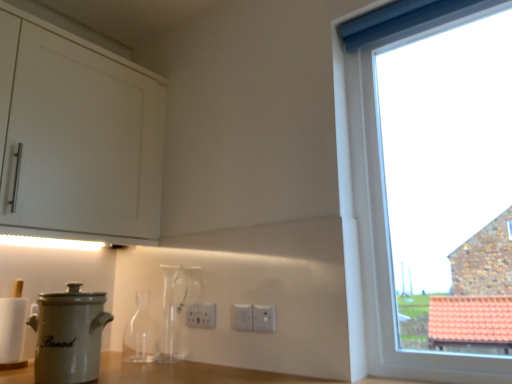
Question: Which direction should I rotate to look at white plastic electric outlet at center, marked as the 1th electric outlet in a right-to-left arrangement?

Choices:
 (A) left
 (B) right

Answer: (B)

Question: Is white matte cabinet at upper left completely or partially inside white plastic electric outlet at center, marked as the 1th electric outlet in a right-to-left arrangement?

Choices:
 (A) yes
 (B) no

Answer: (B)

Question: Is white plastic electric outlet at center, the third electric outlet positioned from the back, positioned with its back to white matte cabinet at upper left?

Choices:
 (A) yes
 (B) no

Answer: (B)

Question: Can you confirm if white plastic electric outlet at center, the third electric outlet positioned from the back, is wider than white matte cabinet at upper left?

Choices:
 (A) no
 (B) yes

Answer: (A)

Question: From a real-world perspective, is white plastic electric outlet at center, the third electric outlet positioned from the back, positioned under white matte cabinet at upper left based on gravity?

Choices:
 (A) no
 (B) yes

Answer: (B)

Question: From the image's perspective, is white plastic electric outlet at center, placed as the first electric outlet when sorted from front to back, located beneath white matte cabinet at upper left?

Choices:
 (A) no
 (B) yes

Answer: (B)

Question: Is the depth of white plastic electric outlet at center, marked as the 1th electric outlet in a right-to-left arrangement, greater than that of white matte cabinet at upper left?

Choices:
 (A) yes
 (B) no

Answer: (A)

Question: From the image's perspective, does white ceramic bread bin at lower left appear higher than transparent glass bottle at center, which is the first bottle in left-to-right order?

Choices:
 (A) yes
 (B) no

Answer: (A)

Question: Is white ceramic bread bin at lower left not inside transparent glass bottle at center, which is the first bottle in left-to-right order?

Choices:
 (A) yes
 (B) no

Answer: (A)

Question: Can you confirm if white ceramic bread bin at lower left is bigger than transparent glass bottle at center, which is the first bottle in left-to-right order?

Choices:
 (A) no
 (B) yes

Answer: (B)

Question: Is transparent glass bottle at center, the 2th bottle viewed from the right, located within white ceramic bread bin at lower left?

Choices:
 (A) no
 (B) yes

Answer: (A)

Question: Can you confirm if white ceramic bread bin at lower left is wider than transparent glass bottle at center, which is the first bottle in left-to-right order?

Choices:
 (A) yes
 (B) no

Answer: (A)

Question: Considering the relative positions of white ceramic bread bin at lower left and transparent glass bottle at center, the 2th bottle viewed from the right, in the image provided, is white ceramic bread bin at lower left to the right of transparent glass bottle at center, the 2th bottle viewed from the right, from the viewer's perspective?

Choices:
 (A) yes
 (B) no

Answer: (B)

Question: Does white plastic electric outlet at center, marked as the 1th electric outlet in a back-to-front arrangement, have a greater width compared to white plastic electric outlet at center, which is the 2th electric outlet from left to right?

Choices:
 (A) yes
 (B) no

Answer: (A)